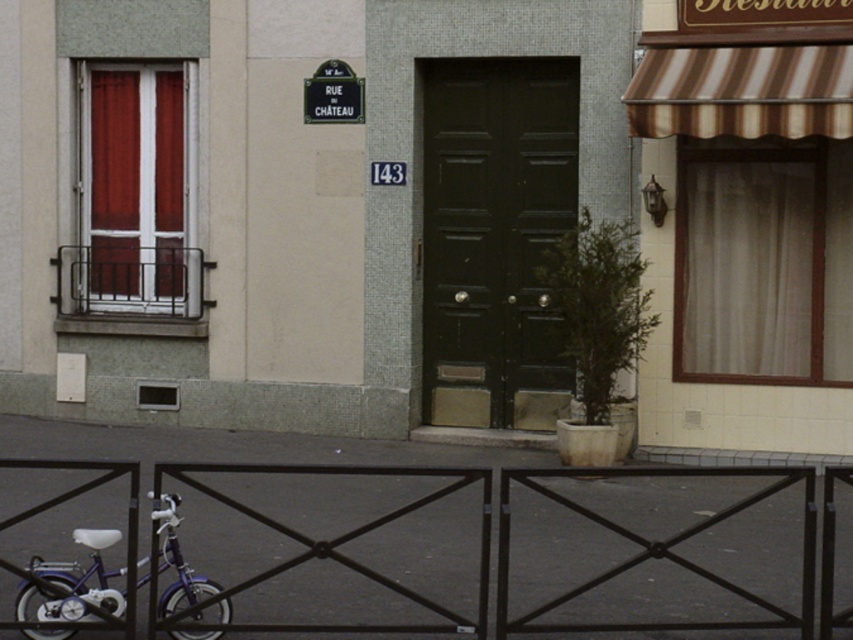
Question: Considering the real-world distances, which object is farthest from the green metal sign at upper center?

Choices:
 (A) shiny purple bicycle at lower left
 (B) black metal fence at lower center

Answer: (A)

Question: Which of the following is the farthest from the observer?

Choices:
 (A) (44, 593)
 (B) (506, 488)

Answer: (B)

Question: Which of the following is the closest to the observer?

Choices:
 (A) (192, 602)
 (B) (334, 90)
 (C) (814, 509)

Answer: (C)

Question: In this image, where is black metal fence at lower center located relative to shiny purple bicycle at lower left?

Choices:
 (A) above
 (B) below

Answer: (B)

Question: Where is black metal fence at lower center located in relation to shiny purple bicycle at lower left in the image?

Choices:
 (A) left
 (B) right

Answer: (B)

Question: Does black metal fence at lower center appear under shiny purple bicycle at lower left?

Choices:
 (A) no
 (B) yes

Answer: (B)